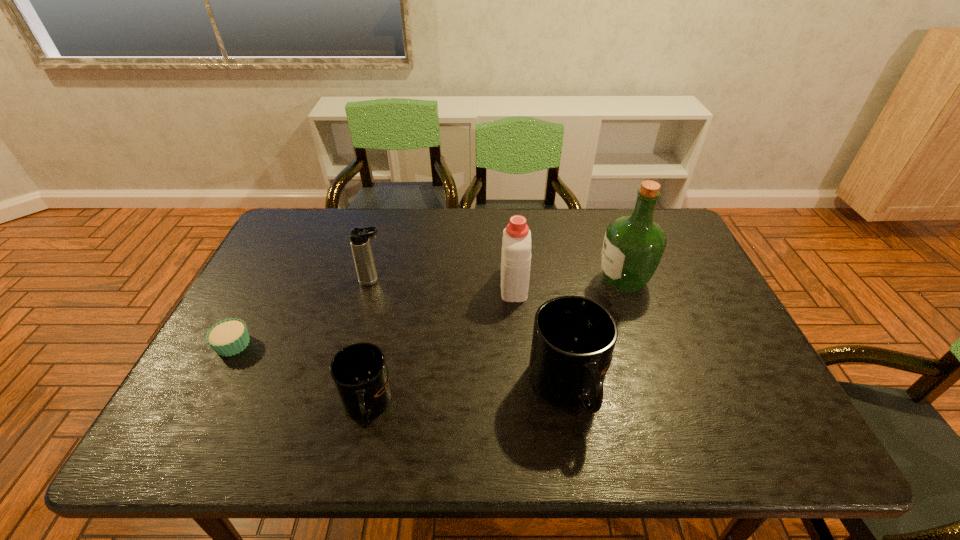
This screenshot has height=540, width=960. Identify the location of vacant space that's between the thermos bottle and the right mug. (470, 334).

Point out which object is positioned as the second nearest to the tallest object. Please provide its 2D coordinates. Your answer should be formatted as a tuple, i.e. [(x, y)], where the tuple contains the x and y coordinates of a point satisfying the conditions above.

[(516, 243)]

In order to click on the fourth closest object to the taller mug in this screenshot , I will do `click(359, 237)`.

The image size is (960, 540). In order to click on vacant area that satisfies the following two spatial constraints: 1. on the front-facing side of the liquor; 2. with the handle on the side of the right mug in this screenshot , I will do `click(661, 387)`.

Locate an element on the screen. This screenshot has height=540, width=960. free space that satisfies the following two spatial constraints: 1. on the front-facing side of the tallest object; 2. with the handle on the side of the right mug is located at coordinates (661, 387).

Where is `free point that satisfies the following two spatial constraints: 1. on the handle side of the fifth shortest object; 2. on the handle side of the thermos bottle`? The image size is (960, 540). free point that satisfies the following two spatial constraints: 1. on the handle side of the fifth shortest object; 2. on the handle side of the thermos bottle is located at coordinates (514, 281).